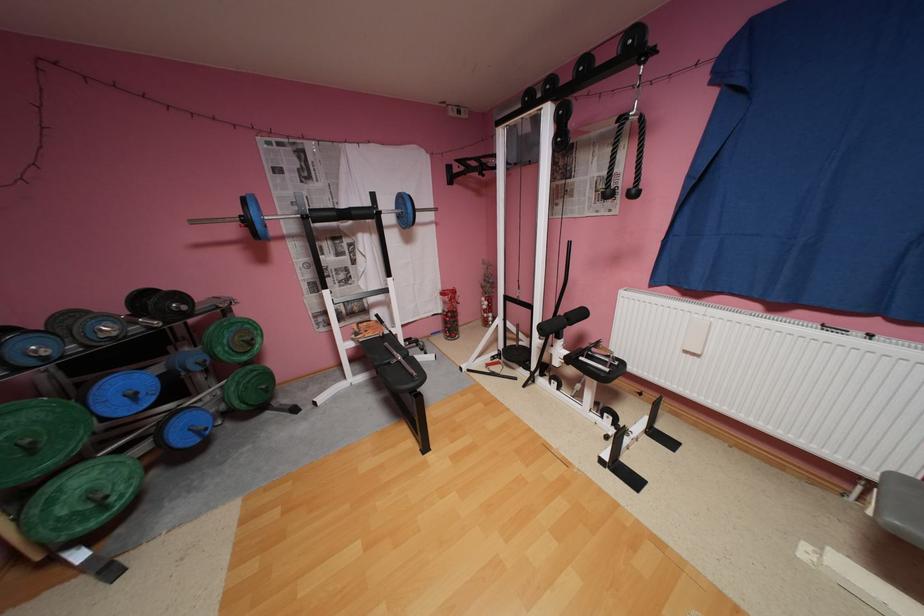
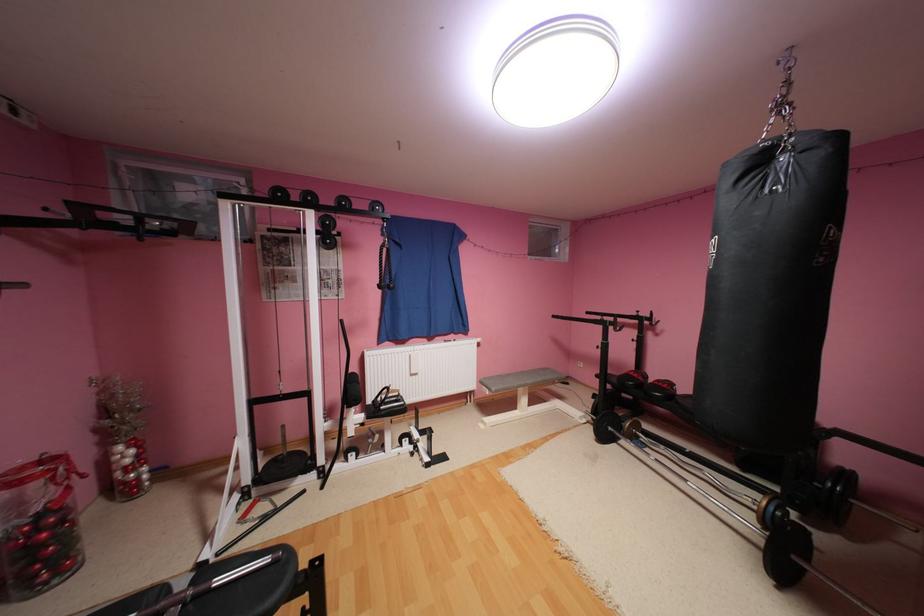
Where in the second image is the point corresponding to point 509,347 from the first image?

(256, 479)